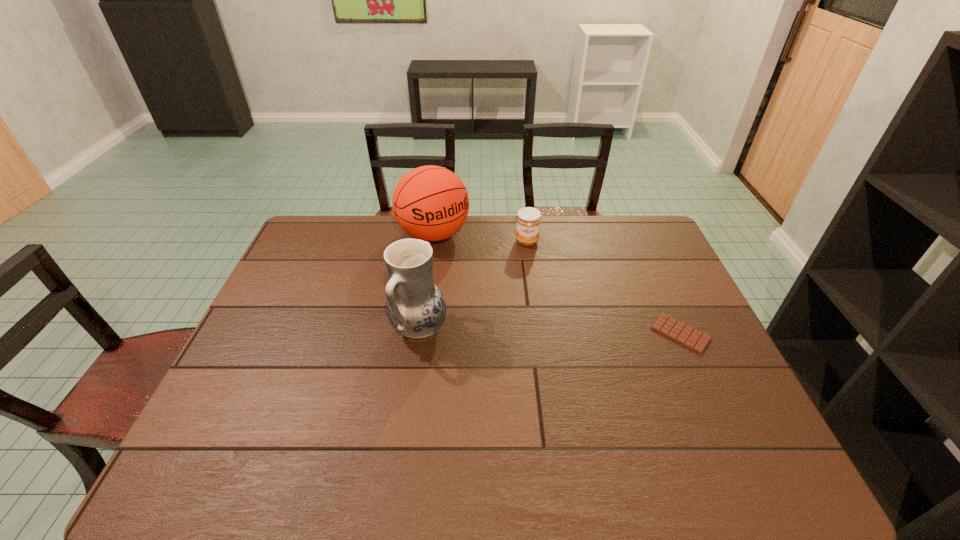
Identify the location of vacant space that is in between the rightmost object and the pottery. The height and width of the screenshot is (540, 960). pyautogui.click(x=550, y=331).

Image resolution: width=960 pixels, height=540 pixels. In order to click on empty space that is in between the candy bar and the pottery in this screenshot , I will do `click(550, 331)`.

Find the location of a particular element. This screenshot has width=960, height=540. the third closest object to the pottery is located at coordinates (694, 339).

Point out which object is positioned as the nearest to the jam. Please provide its 2D coordinates. Your answer should be formatted as a tuple, i.e. [(x, y)], where the tuple contains the x and y coordinates of a point satisfying the conditions above.

[(430, 203)]

The image size is (960, 540). What are the coordinates of `free spot that satisfies the following two spatial constraints: 1. on the front side of the second object from right to left; 2. on the right side of the basketball` in the screenshot? It's located at (433, 241).

This screenshot has width=960, height=540. What are the coordinates of `vacant region that satisfies the following two spatial constraints: 1. on the front side of the rightmost object; 2. on the left side of the third tallest object` in the screenshot? It's located at (540, 333).